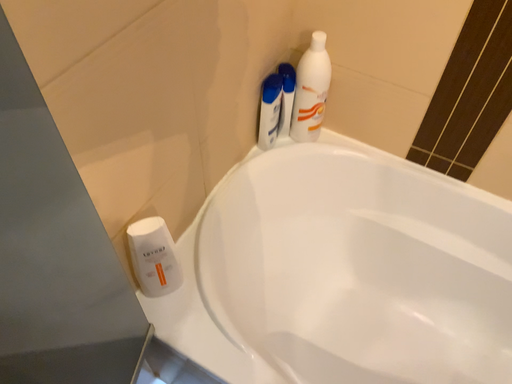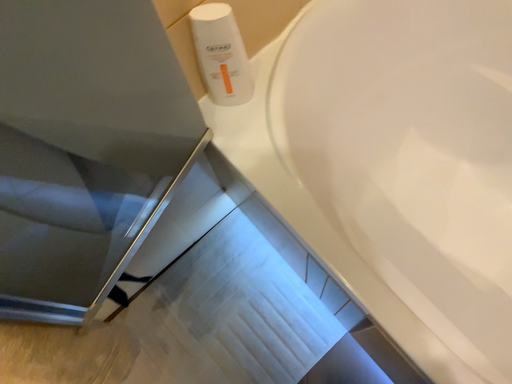
Question: How did the camera likely rotate when shooting the video?

Choices:
 (A) rotated downward
 (B) rotated upward

Answer: (A)